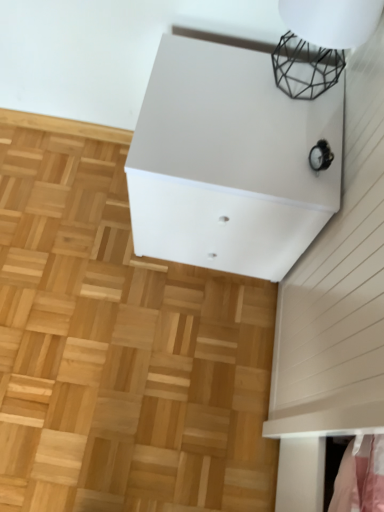
This screenshot has width=384, height=512. In order to click on vacant region to the left of white matte cabinet at upper center in this screenshot , I will do `click(82, 220)`.